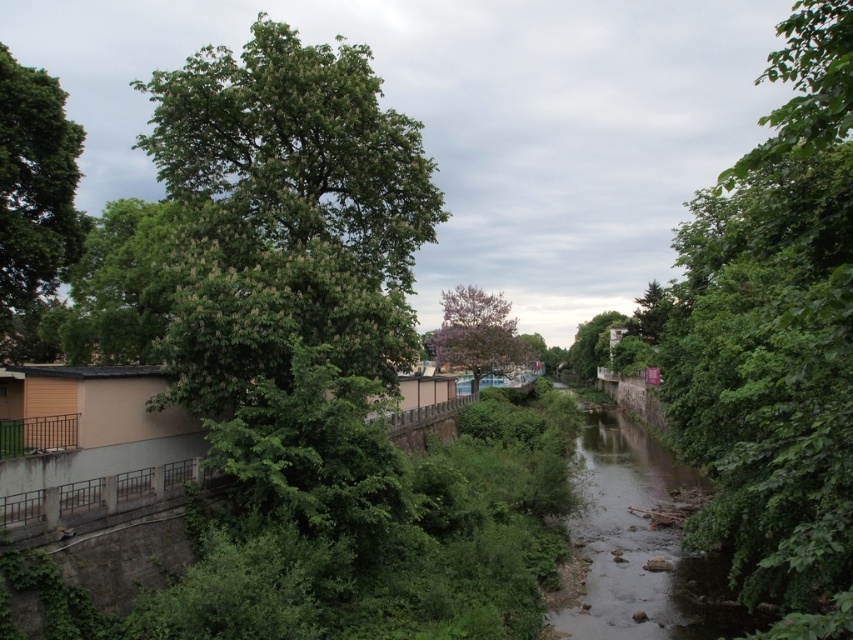
Question: Does green leafy tree at center have a larger size compared to green leafy tree at center-right?

Choices:
 (A) yes
 (B) no

Answer: (A)

Question: Estimate the real-world distances between objects in this image. Which object is farther from the green leafy tree at center-right?

Choices:
 (A) purple-pink blossoming tree at center
 (B) green leafy tree at left
 (C) green leafy tree at center

Answer: (B)

Question: Which object is closer to the camera taking this photo?

Choices:
 (A) green leafy tree at center
 (B) green leafy tree at left
 (C) purple-pink blossoming tree at center

Answer: (A)

Question: Does green leafy tree at left lie in front of green leafy tree at center-right?

Choices:
 (A) yes
 (B) no

Answer: (A)

Question: Can you confirm if green leafy tree at center is positioned to the left of green leafy tree at center-right?

Choices:
 (A) no
 (B) yes

Answer: (A)

Question: Which is nearer to the purple-pink blossoming tree at center?

Choices:
 (A) green leafy tree at center-right
 (B) green leafy tree at left
 (C) green leafy tree at center

Answer: (C)